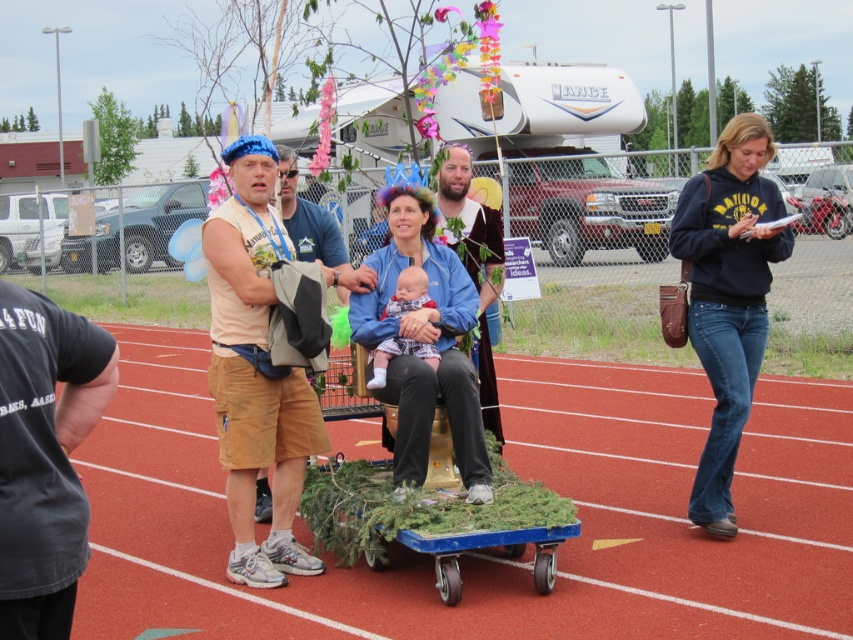
Between brown leather jacket at center and soft white baby at center, which one is positioned higher?

brown leather jacket at center is above.

Is point (457, 237) farther from viewer compared to point (386, 368)?

Yes, it is behind point (386, 368).

Between point (485, 380) and point (431, 300), which one is positioned behind?

Point (485, 380)

Find the location of a particular element. brown leather jacket at center is located at coordinates (474, 262).

Does point (262, 550) lie behind point (277, 147)?

No, (262, 550) is closer to viewer.

Between point (241, 346) and point (291, 172), which one is positioned behind?

The point (291, 172) is more distant.

Is point (283, 442) positioned after point (323, 214)?

No.

This screenshot has width=853, height=640. Find the location of `tan cargo shorts at center`. tan cargo shorts at center is located at coordinates (256, 371).

Between blue denim jacket at center and tan fabric shorts at left, which one has more height?

blue denim jacket at center is taller.

Locate an element on the screen. The image size is (853, 640). blue denim jacket at center is located at coordinates (427, 342).

Identify the location of blue denim jacket at center. Image resolution: width=853 pixels, height=640 pixels. (427, 342).